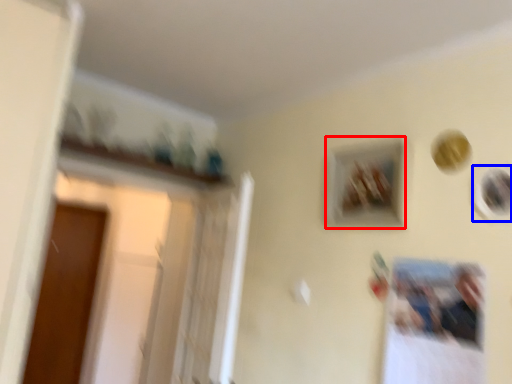
Question: Which object is closer to the camera taking this photo, picture frame (highlighted by a red box) or picture frame (highlighted by a blue box)?

Choices:
 (A) picture frame
 (B) picture frame

Answer: (B)